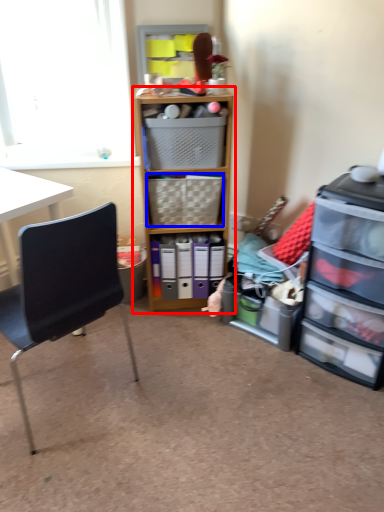
Question: Which object is further to the camera taking this photo, cabinetry (highlighted by a red box) or picnic basket (highlighted by a blue box)?

Choices:
 (A) cabinetry
 (B) picnic basket

Answer: (B)